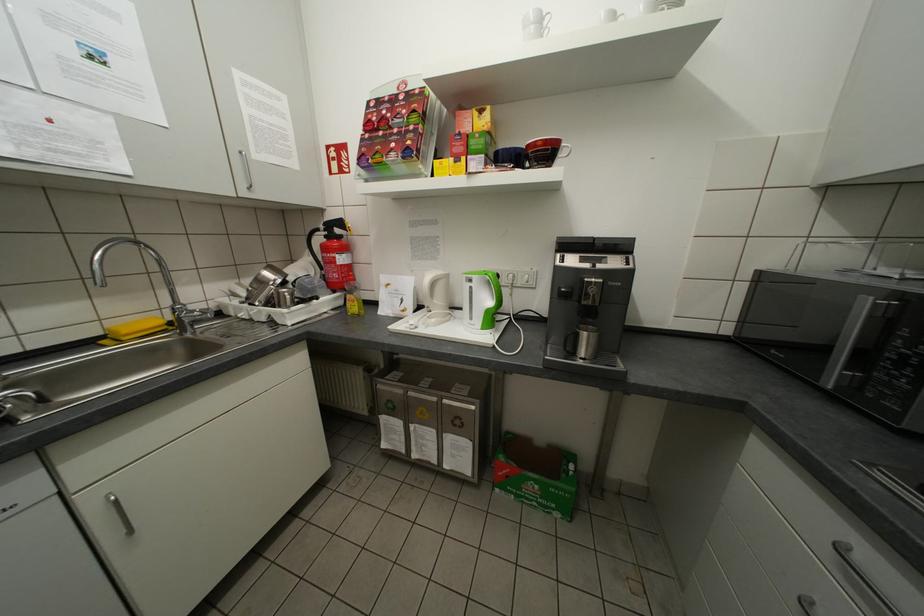
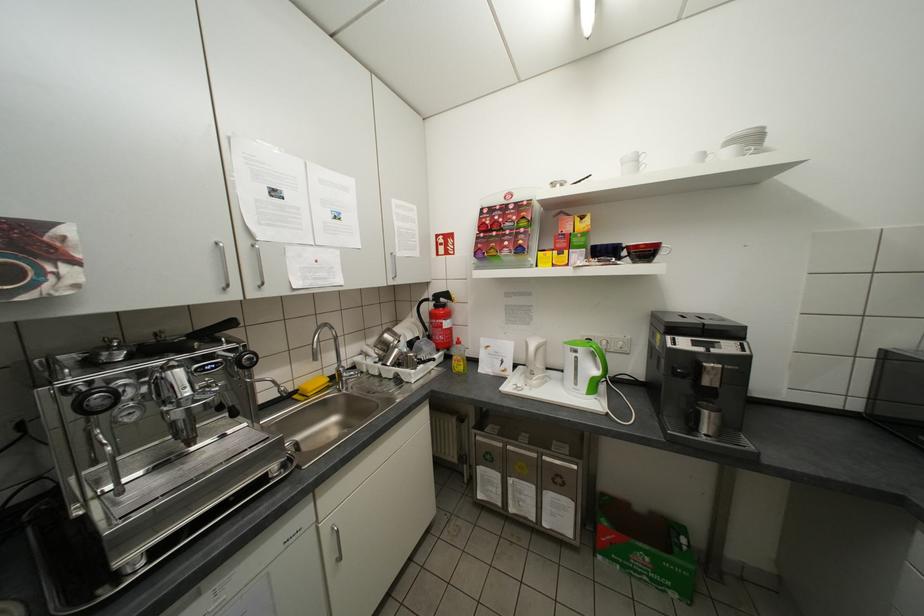
Find the pixel in the second image that matches pixel 442 321 in the first image.

(543, 382)